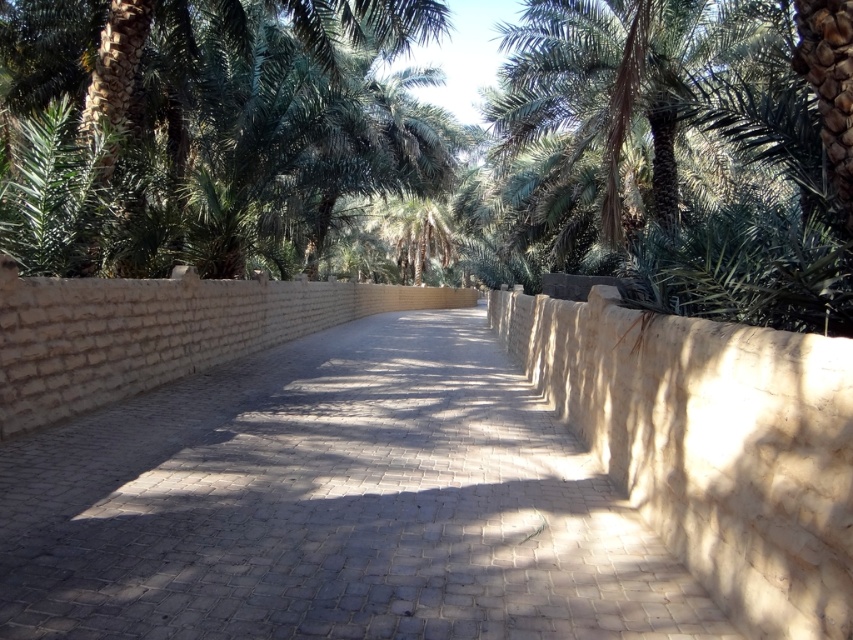
Is green leafy palm tree at center above green leafy palm tree at upper center?

Indeed, green leafy palm tree at center is positioned over green leafy palm tree at upper center.

Does green leafy palm tree at center have a larger size compared to green leafy palm tree at upper center?

Indeed, green leafy palm tree at center has a larger size compared to green leafy palm tree at upper center.

Which is in front, point (291, 120) or point (744, 29)?

Point (744, 29) is more forward.

Identify the location of green leafy palm tree at center. (207, 129).

Is point (26, 476) less distant than point (74, 72)?

Yes.

Does light beige cobblestone pavement at center appear on the left side of green leafy palm tree at center?

Incorrect, light beige cobblestone pavement at center is not on the left side of green leafy palm tree at center.

This screenshot has height=640, width=853. Identify the location of light beige cobblestone pavement at center. (334, 506).

Can you confirm if light beige cobblestone pavement at center is bigger than green leafy palm tree at upper center?

No, light beige cobblestone pavement at center is not bigger than green leafy palm tree at upper center.

Is point (196, 486) closer to camera compared to point (601, 163)?

That is True.

Find the location of a particular element. light beige cobblestone pavement at center is located at coordinates (334, 506).